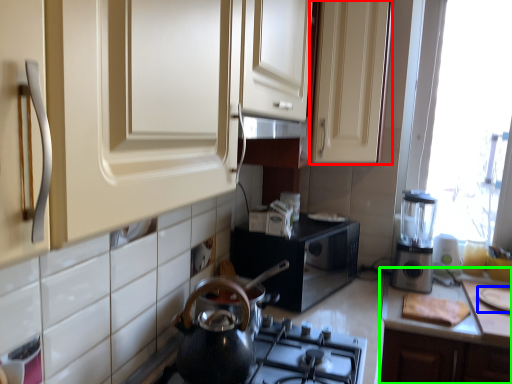
Question: Which is farther away from cabinetry (highlighted by a red box)? appliance (highlighted by a blue box) or countertop (highlighted by a green box)?

Choices:
 (A) appliance
 (B) countertop

Answer: (A)